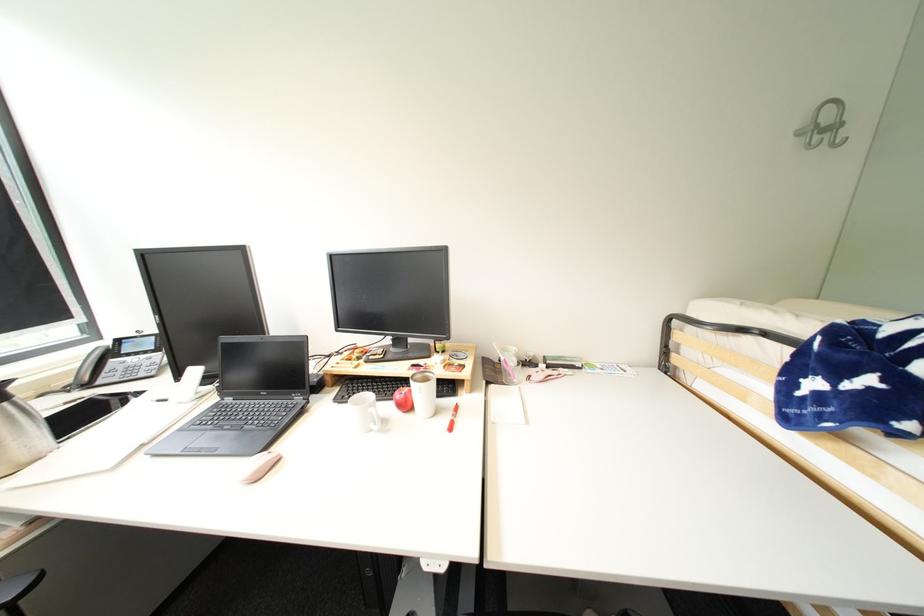
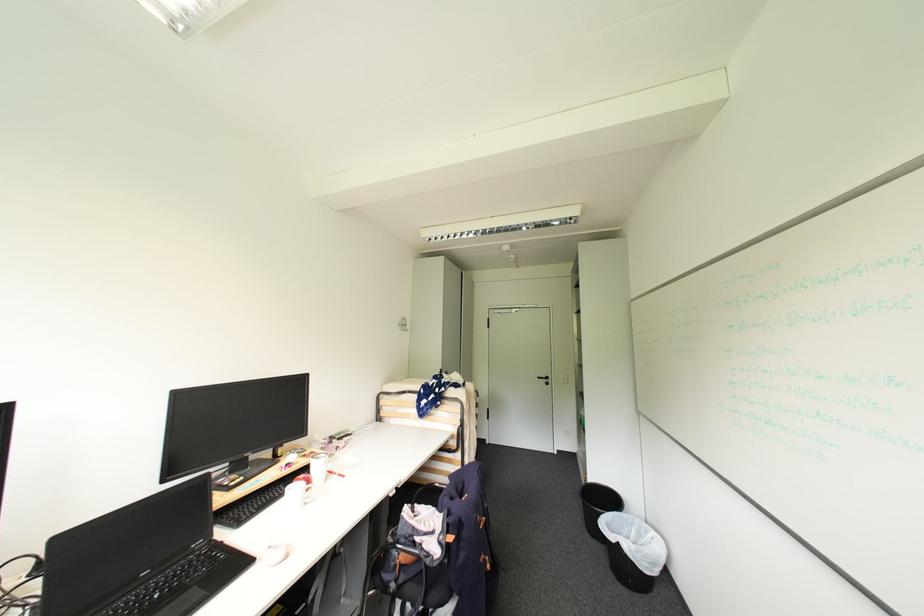
Where in the second image is the point corresponding to point 807,132 from the first image?

(406, 325)